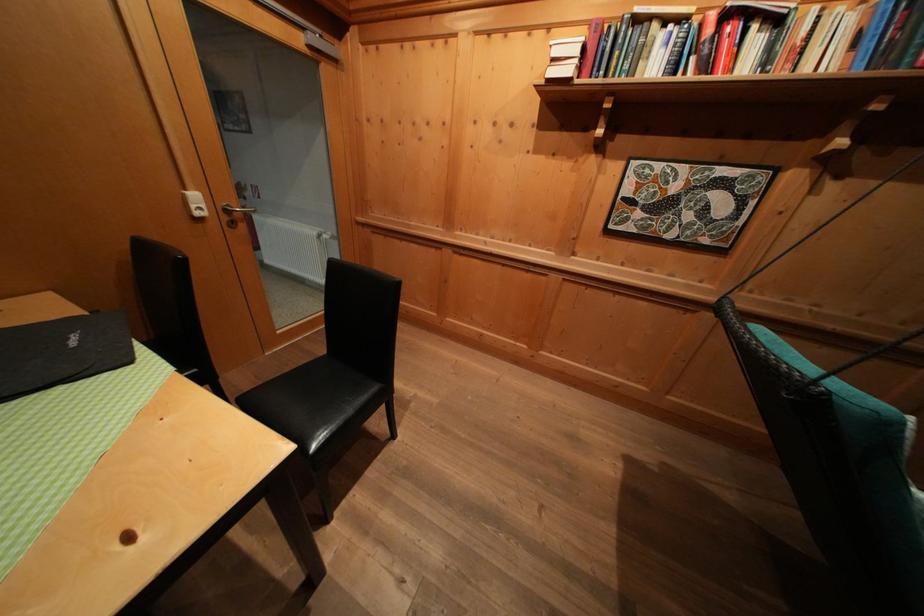
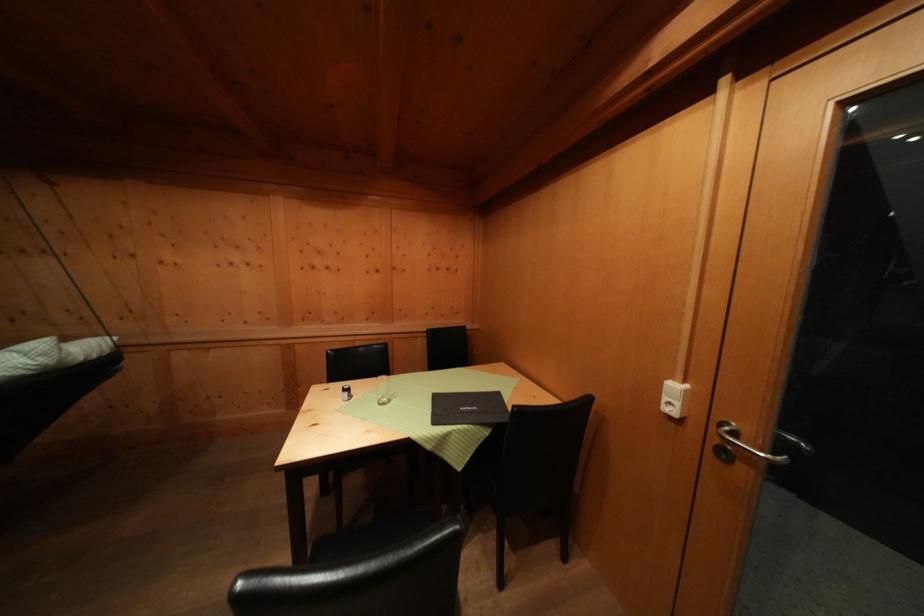
In the second image, find the point that corresponds to (x=200, y=211) in the first image.

(672, 403)